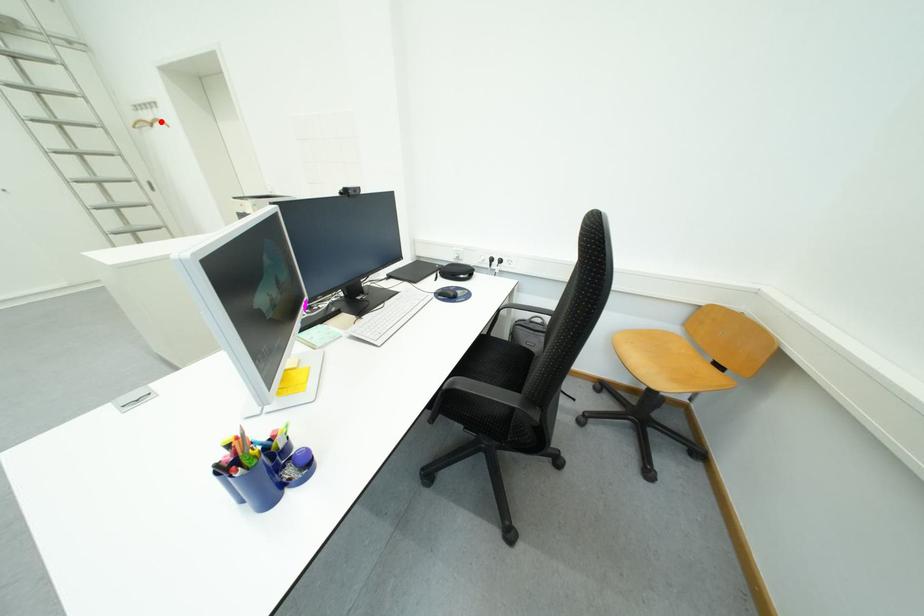
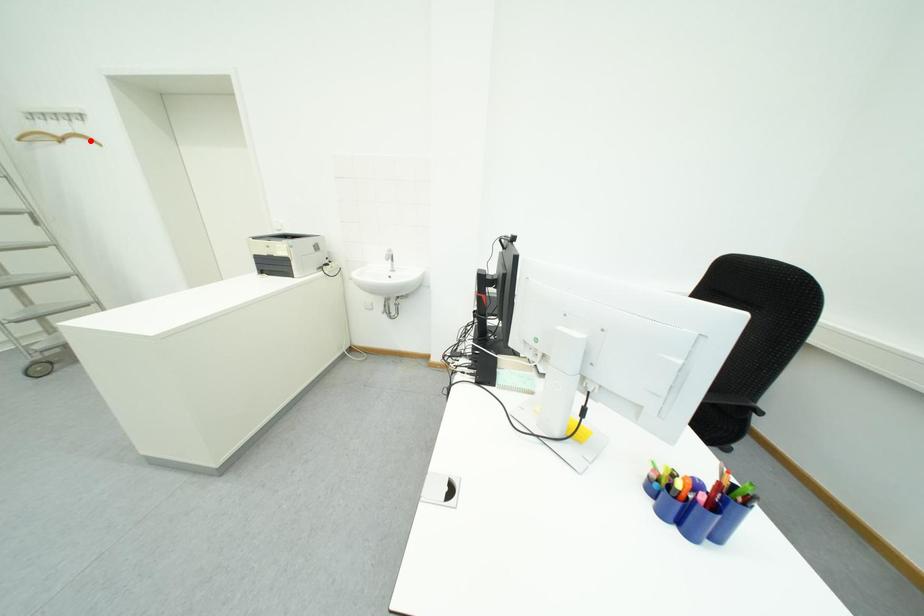
I am providing you with two images of the same scene from different viewpoints. A red point is marked on the first image and another point is marked on the second image. Is the red point in image1 aligned with the point shown in image2?

No